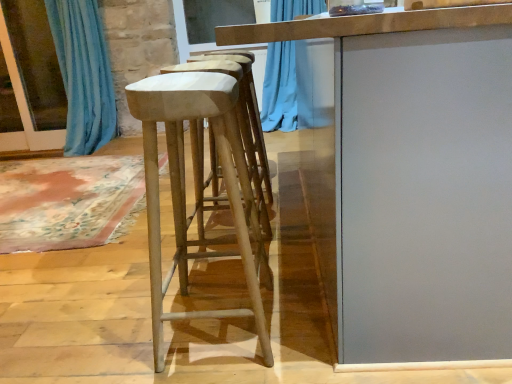
Measure the distance between smooth gray table at center and camera.

smooth gray table at center and camera are 33.44 inches apart.

Image resolution: width=512 pixels, height=384 pixels. What are the coordinates of `blue fabric curtain at left` in the screenshot? It's located at (83, 74).

Is blue fabric curtain at left oriented towards light brown wood stool at center?

No.

How many degrees apart are the facing directions of blue fabric curtain at left and light brown wood stool at center?

The angular difference between blue fabric curtain at left and light brown wood stool at center is 89.9 degrees.

Does blue fabric curtain at left appear on the left side of light brown wood stool at center?

Indeed, blue fabric curtain at left is positioned on the left side of light brown wood stool at center.

Which of these two, blue fabric curtain at left or light brown wood stool at center, is smaller?

Smaller between the two is blue fabric curtain at left.

Does smooth gray table at center have a greater width compared to light brown wood stool at center?

Indeed, smooth gray table at center has a greater width compared to light brown wood stool at center.

Is smooth gray table at center bigger than light brown wood stool at center?

Yes.

At what (x,y) coordinates should I click in order to perform the action: click on table in front of the light brown wood stool at center. Please return your answer as a coordinate pair (x, y). This screenshot has height=384, width=512. Looking at the image, I should click on (343, 119).

Do you think smooth gray table at center is within light brown wood stool at center, or outside of it?

The correct answer is: outside.

From a real-world perspective, is blue fabric curtain at left physically located above or below smooth gray table at center?

From a real-world perspective, blue fabric curtain at left is physically above smooth gray table at center.

Looking at their sizes, would you say blue fabric curtain at left is wider or thinner than smooth gray table at center?

blue fabric curtain at left is thinner than smooth gray table at center.

Does blue fabric curtain at left have a larger size compared to smooth gray table at center?

No.

Considering the sizes of objects light brown wood stool at center and smooth gray table at center in the image provided, who is wider, light brown wood stool at center or smooth gray table at center?

smooth gray table at center is wider.

From the picture: From the image's perspective, would you say light brown wood stool at center is positioned over smooth gray table at center?

No, from the image's perspective, light brown wood stool at center is not over smooth gray table at center.

Looking at the image, does light brown wood stool at center seem bigger or smaller compared to smooth gray table at center?

In the image, light brown wood stool at center appears to be smaller than smooth gray table at center.

Are smooth gray table at center and blue fabric curtain at left making contact?

smooth gray table at center and blue fabric curtain at left are not in contact.

Could you tell me if smooth gray table at center is facing blue fabric curtain at left?

No, smooth gray table at center is not aimed at blue fabric curtain at left.

Is point (339, 110) positioned after point (97, 97)?

That is False.

Is the surface of light brown wood stool at center in direct contact with blue fabric curtain at left?

They are not placed beside each other.

Which of these two, light brown wood stool at center or blue fabric curtain at left, is bigger?

light brown wood stool at center.

From a real-world perspective, is light brown wood stool at center positioned under blue fabric curtain at left based on gravity?

Yes.

Where is `stool in front of the blue fabric curtain at left`? This screenshot has width=512, height=384. stool in front of the blue fabric curtain at left is located at coordinates (184, 188).

Identify the location of stool below the smooth gray table at center (from the image's perspective). (184, 188).

From the picture: Looking at the image, which one is located closer to light brown wood stool at center, smooth gray table at center or blue fabric curtain at left?

smooth gray table at center lies closer to light brown wood stool at center than the other object.

When comparing their distances from smooth gray table at center, does blue fabric curtain at left or light brown wood stool at center seem further?

Based on the image, blue fabric curtain at left appears to be further to smooth gray table at center.

Estimate the real-world distances between objects in this image. Which object is further from blue fabric curtain at left, light brown wood stool at center or smooth gray table at center?

The object further to blue fabric curtain at left is smooth gray table at center.

Estimate the real-world distances between objects in this image. Which object is further from smooth gray table at center, light brown wood stool at center or blue fabric curtain at left?

Among the two, blue fabric curtain at left is located further to smooth gray table at center.

Considering their positions, is blue fabric curtain at left positioned closer to light brown wood stool at center than smooth gray table at center?

Among the two, smooth gray table at center is located nearer to light brown wood stool at center.

From the image, which object appears to be farther from blue fabric curtain at left, smooth gray table at center or light brown wood stool at center?

The object further to blue fabric curtain at left is smooth gray table at center.

At what (x,y) coordinates should I click in order to perform the action: click on stool positioned between smooth gray table at center and blue fabric curtain at left from near to far. Please return your answer as a coordinate pair (x, y). The width and height of the screenshot is (512, 384). Looking at the image, I should click on (184, 188).